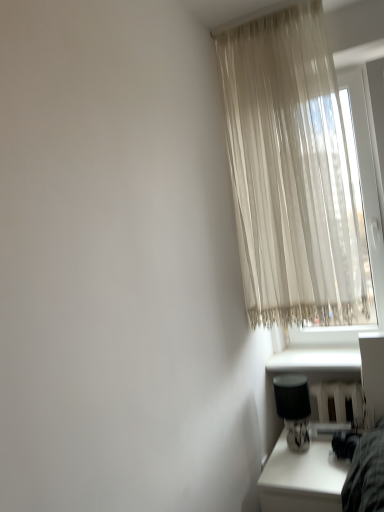
Identify the location of vacant space in front of black fabric table lamp at lower right. The width and height of the screenshot is (384, 512). (306, 466).